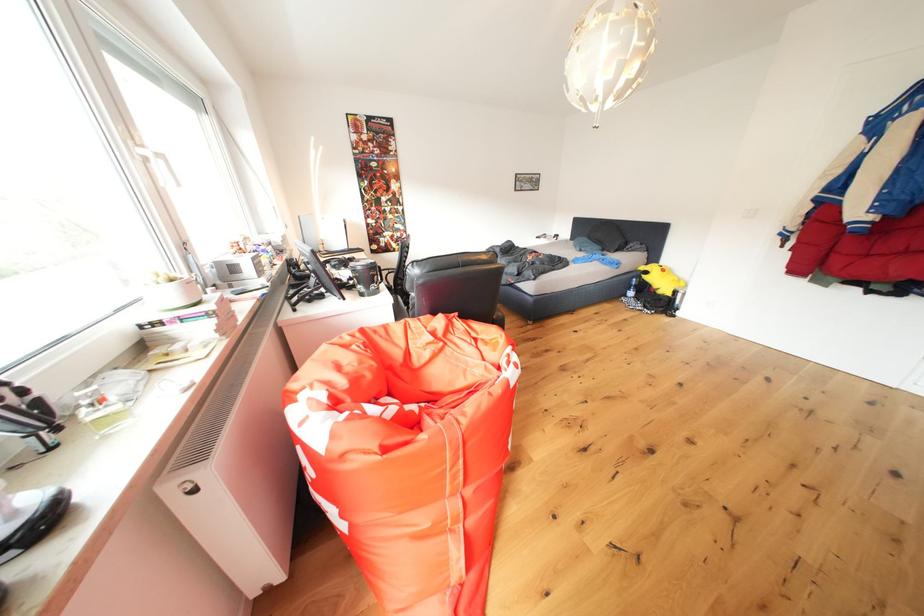
Image resolution: width=924 pixels, height=616 pixels. I want to click on black travel mug, so (366, 276).